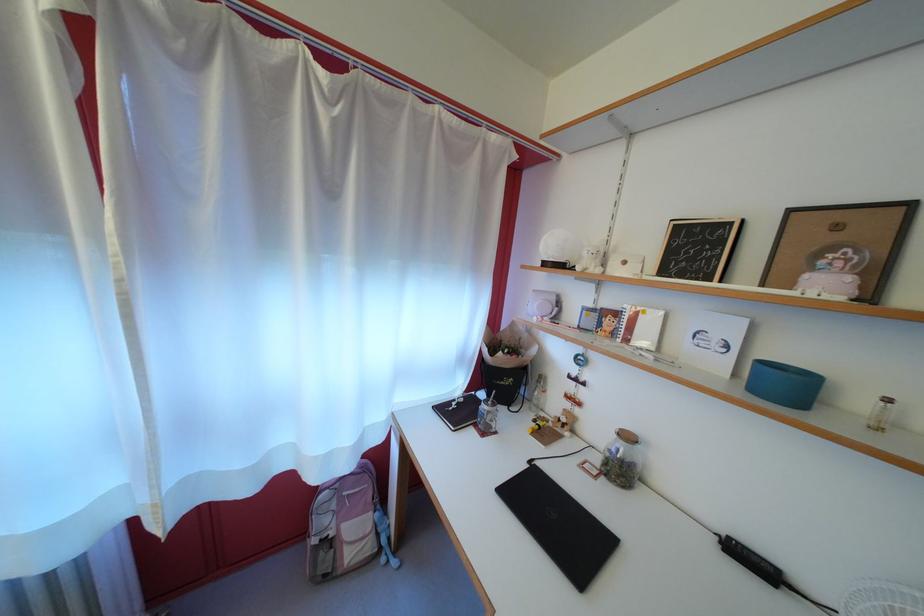
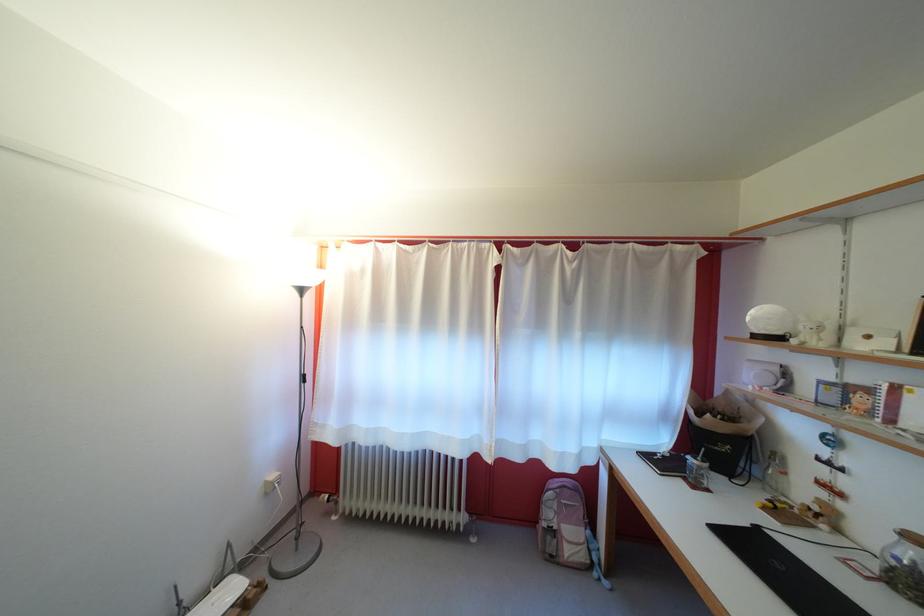
Question: The camera is either moving clockwise (left) or counter-clockwise (right) around the object. The first image is from the beginning of the video and the second image is from the end. Is the camera moving left or right when shooting the video?

Choices:
 (A) Left
 (B) Right

Answer: (B)